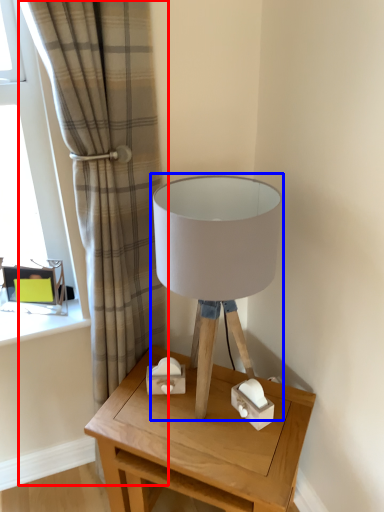
Question: Which object is closer to the camera taking this photo, curtain (highlighted by a red box) or lamp (highlighted by a blue box)?

Choices:
 (A) curtain
 (B) lamp

Answer: (A)